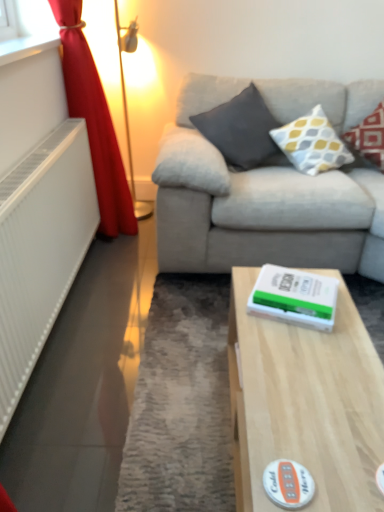
What do you see at coordinates (242, 131) in the screenshot? I see `dark gray fabric pillow at upper center, the first pillow when ordered from left to right` at bounding box center [242, 131].

What do you see at coordinates (312, 143) in the screenshot? Image resolution: width=384 pixels, height=512 pixels. I see `white textured pillow at upper right, the second pillow viewed from the right` at bounding box center [312, 143].

What do you see at coordinates (305, 402) in the screenshot?
I see `light wood table at center` at bounding box center [305, 402].

At what (x,y) coordinates should I click in order to perform the action: click on light wood table at center. Please return your answer as a coordinate pair (x, y). This screenshot has height=512, width=384. Looking at the image, I should click on (305, 402).

Locate an element on the screen. This screenshot has height=512, width=384. white plastic radiator at left is located at coordinates (41, 249).

Identify the location of metallic gold table lamp at left. Image resolution: width=384 pixels, height=512 pixels. (126, 105).

From the image's perspective, between patterned fabric pillow at upper right, acting as the third pillow starting from the left, and white textured pillow at upper right, the second pillow viewed from the right, who is located below?

From the image's view, white textured pillow at upper right, the second pillow viewed from the right, is below.

Could white textured pillow at upper right, placed as the 2th pillow when sorted from left to right, be considered to be inside patterned fabric pillow at upper right, acting as the third pillow starting from the left?

No, patterned fabric pillow at upper right, acting as the third pillow starting from the left, does not contain white textured pillow at upper right, placed as the 2th pillow when sorted from left to right.

Considering the sizes of objects patterned fabric pillow at upper right, acting as the third pillow starting from the left, and white textured pillow at upper right, placed as the 2th pillow when sorted from left to right, in the image provided, who is wider, patterned fabric pillow at upper right, acting as the third pillow starting from the left, or white textured pillow at upper right, placed as the 2th pillow when sorted from left to right,?

patterned fabric pillow at upper right, acting as the third pillow starting from the left, is wider.

Considering the relative positions of patterned fabric pillow at upper right, the 1th pillow from the right, and white textured pillow at upper right, placed as the 2th pillow when sorted from left to right, in the image provided, is patterned fabric pillow at upper right, the 1th pillow from the right, to the left of white textured pillow at upper right, placed as the 2th pillow when sorted from left to right, from the viewer's perspective?

In fact, patterned fabric pillow at upper right, the 1th pillow from the right, is to the right of white textured pillow at upper right, placed as the 2th pillow when sorted from left to right.

Which object is positioned more to the left, dark gray fabric pillow at upper center, positioned as the third pillow in right-to-left order, or white plastic radiator at left?

white plastic radiator at left is more to the left.

From the image's perspective, is dark gray fabric pillow at upper center, positioned as the third pillow in right-to-left order, positioned above or below white plastic radiator at left?

From the image's perspective, dark gray fabric pillow at upper center, positioned as the third pillow in right-to-left order, appears above white plastic radiator at left.

Consider the image. How many degrees apart are the facing directions of dark gray fabric pillow at upper center, the first pillow when ordered from left to right, and white plastic radiator at left?

The facing directions of dark gray fabric pillow at upper center, the first pillow when ordered from left to right, and white plastic radiator at left are 89.9 degrees apart.

Considering the points (256, 132) and (54, 223), which point is in front, point (256, 132) or point (54, 223)?

The point (54, 223) is in front.

Does white textured pillow at upper right, placed as the 2th pillow when sorted from left to right, have a larger size compared to dark gray fabric pillow at upper center, positioned as the third pillow in right-to-left order?

Actually, white textured pillow at upper right, placed as the 2th pillow when sorted from left to right, might be smaller than dark gray fabric pillow at upper center, positioned as the third pillow in right-to-left order.

Is point (320, 160) farther from viewer compared to point (267, 149)?

No, (320, 160) is in front of (267, 149).

From a real-world perspective, is white textured pillow at upper right, the second pillow viewed from the right, above or below dark gray fabric pillow at upper center, positioned as the third pillow in right-to-left order?

Clearly, from a real-world perspective, white textured pillow at upper right, the second pillow viewed from the right, is above dark gray fabric pillow at upper center, positioned as the third pillow in right-to-left order.

Which is more to the right, white textured pillow at upper right, the second pillow viewed from the right, or dark gray fabric pillow at upper center, positioned as the third pillow in right-to-left order?

From the viewer's perspective, white textured pillow at upper right, the second pillow viewed from the right, appears more on the right side.

Considering the sizes of white matte sticker at lower center and patterned fabric pillow at upper right, the 1th pillow from the right, in the image, is white matte sticker at lower center bigger or smaller than patterned fabric pillow at upper right, the 1th pillow from the right,?

In the image, white matte sticker at lower center appears to be smaller than patterned fabric pillow at upper right, the 1th pillow from the right.

Considering the points (273, 498) and (378, 123), which point is behind, point (273, 498) or point (378, 123)?

Positioned behind is point (378, 123).

Which of these two, white matte sticker at lower center or patterned fabric pillow at upper right, acting as the third pillow starting from the left, stands taller?

Standing taller between the two is patterned fabric pillow at upper right, acting as the third pillow starting from the left.

How distant is white matte sticker at lower center from patterned fabric pillow at upper right, acting as the third pillow starting from the left?

They are 2.03 meters apart.

Considering the sizes of objects white textured pillow at upper right, the second pillow viewed from the right, and metallic gold table lamp at left in the image provided, who is bigger, white textured pillow at upper right, the second pillow viewed from the right, or metallic gold table lamp at left?

metallic gold table lamp at left is bigger.

Considering the relative sizes of white textured pillow at upper right, the second pillow viewed from the right, and metallic gold table lamp at left in the image provided, is white textured pillow at upper right, the second pillow viewed from the right, shorter than metallic gold table lamp at left?

Correct, white textured pillow at upper right, the second pillow viewed from the right, is not as tall as metallic gold table lamp at left.

The height and width of the screenshot is (512, 384). What are the coordinates of `table lamp below the white textured pillow at upper right, the second pillow viewed from the right (from a real-world perspective)` in the screenshot? It's located at (126, 105).

Considering the points (296, 146) and (134, 48), which point is in front, point (296, 146) or point (134, 48)?

The point (296, 146) is closer.

Looking at the image, does white matte paperback book at center seem bigger or smaller compared to white plastic radiator at left?

Clearly, white matte paperback book at center is smaller in size than white plastic radiator at left.

Would you say white plastic radiator at left is part of white matte paperback book at center's contents?

No, white plastic radiator at left is not surrounded by white matte paperback book at center.

How far apart are white matte paperback book at center and white plastic radiator at left?

white matte paperback book at center is 36.89 inches away from white plastic radiator at left.

Between point (328, 312) and point (70, 241), which one is positioned behind?

The point (70, 241) is behind.

Does patterned fabric pillow at upper right, acting as the third pillow starting from the left, turn towards white matte paperback book at center?

No, patterned fabric pillow at upper right, acting as the third pillow starting from the left, does not turn towards white matte paperback book at center.

Image resolution: width=384 pixels, height=512 pixels. In order to click on pillow that is the 2nd one when counting upward from the white matte paperback book at center (from the image's perspective) in this screenshot , I will do `click(368, 140)`.

Is patterned fabric pillow at upper right, acting as the third pillow starting from the left, to the left of white matte paperback book at center from the viewer's perspective?

No.

From the image's perspective, starting from the white textured pillow at upper right, placed as the 2th pillow when sorted from left to right, which pillow is the 1st one above? Please provide its 2D coordinates.

[(368, 140)]

Identify the location of the 3rd pillow behind when counting from the white plastic radiator at left. (242, 131).

From the image, which object appears to be farther from metallic gold table lamp at left, white matte paperback book at center or light wood table at center?

Among the two, light wood table at center is located further to metallic gold table lamp at left.

Considering their positions, is light wood table at center positioned further to metallic gold table lamp at left than white matte paperback book at center?

light wood table at center.

Estimate the real-world distances between objects in this image. Which object is closer to white matte paperback book at center, light wood table at center or white plastic radiator at left?

Among the two, light wood table at center is located nearer to white matte paperback book at center.

Estimate the real-world distances between objects in this image. Which object is further from light wood table at center, metallic gold table lamp at left or red velvet curtain at left?

The object further to light wood table at center is metallic gold table lamp at left.

When comparing their distances from dark gray fabric pillow at upper center, positioned as the third pillow in right-to-left order, does white plastic radiator at left or white textured pillow at upper right, placed as the 2th pillow when sorted from left to right, seem closer?

Among the two, white textured pillow at upper right, placed as the 2th pillow when sorted from left to right, is located nearer to dark gray fabric pillow at upper center, positioned as the third pillow in right-to-left order.

From the image, which object appears to be farther from metallic gold table lamp at left, light wood table at center or red velvet curtain at left?

The object further to metallic gold table lamp at left is light wood table at center.

From the image, which object appears to be nearer to white matte sticker at lower center, patterned fabric pillow at upper right, the 1th pillow from the right, or white textured pillow at upper right, placed as the 2th pillow when sorted from left to right?

white textured pillow at upper right, placed as the 2th pillow when sorted from left to right, is closer to white matte sticker at lower center.

From the image, which object appears to be farther from white plastic radiator at left, patterned fabric pillow at upper right, the 1th pillow from the right, or light wood table at center?

patterned fabric pillow at upper right, the 1th pillow from the right, lies further to white plastic radiator at left than the other object.

Locate an element on the screen. The width and height of the screenshot is (384, 512). pillow between red velvet curtain at left and white textured pillow at upper right, the second pillow viewed from the right, in the horizontal direction is located at coordinates (242, 131).

Image resolution: width=384 pixels, height=512 pixels. What are the coordinates of `curtain between white textured pillow at upper right, the second pillow viewed from the right, and white matte sticker at lower center vertically` in the screenshot? It's located at (94, 121).

Where is `curtain between dark gray fabric pillow at upper center, positioned as the third pillow in right-to-left order, and white matte paperback book at center from top to bottom`? The image size is (384, 512). curtain between dark gray fabric pillow at upper center, positioned as the third pillow in right-to-left order, and white matte paperback book at center from top to bottom is located at coordinates (94, 121).

Locate an element on the screen. The height and width of the screenshot is (512, 384). sticker between light wood table at center and dark gray fabric pillow at upper center, the first pillow when ordered from left to right, in the front-back direction is located at coordinates (288, 484).